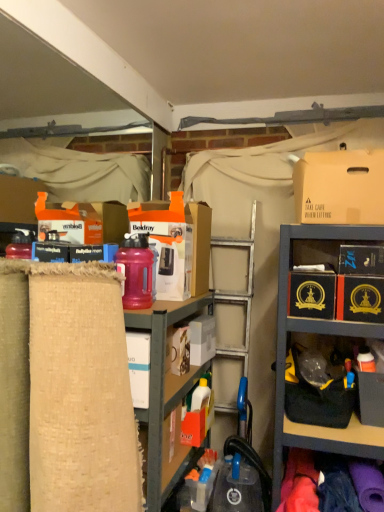
This screenshot has height=512, width=384. I want to click on brown cardboard box at upper right, so click(x=340, y=187).

This screenshot has width=384, height=512. What do you see at coordinates (360, 298) in the screenshot? I see `black cardboard box at right, the first storage box in the right-to-left sequence` at bounding box center [360, 298].

Find the location of a particular element. pink matte water bottle at center-left is located at coordinates (136, 271).

I want to click on white cardboard box at center, marked as the 1th storage box in a left-to-right arrangement, so click(x=177, y=246).

Locate an element on the screen. This screenshot has width=384, height=512. brown cardboard box at upper right is located at coordinates (340, 187).

From the image's perspective, which one is positioned higher, black cardboard box at right, acting as the fifth storage box starting from the left, or white cardboard box at center, the 2th storage box from the left?

From the image's view, black cardboard box at right, acting as the fifth storage box starting from the left, is above.

In terms of size, does black cardboard box at right, acting as the fifth storage box starting from the left, appear bigger or smaller than white cardboard box at center, marked as the 4th storage box in a right-to-left arrangement?

Clearly, black cardboard box at right, acting as the fifth storage box starting from the left, is larger in size than white cardboard box at center, marked as the 4th storage box in a right-to-left arrangement.

Is black cardboard box at right, acting as the fifth storage box starting from the left, positioned with its back to white cardboard box at center, the 2th storage box from the left?

That's not correct — black cardboard box at right, acting as the fifth storage box starting from the left, is not looking away from white cardboard box at center, the 2th storage box from the left.

Is white cardboard box at center, the 2th storage box from the left, next to black cardboard box at center-right, acting as the third storage box starting from the right, and touching it?

white cardboard box at center, the 2th storage box from the left, is not next to black cardboard box at center-right, acting as the third storage box starting from the right, and they're not touching.

From a real-world perspective, is white cardboard box at center, the 2th storage box from the left, over black cardboard box at center-right, acting as the third storage box starting from the right?

No, from a real-world perspective, white cardboard box at center, the 2th storage box from the left, is not on top of black cardboard box at center-right, acting as the third storage box starting from the right.

Looking at this image, does white cardboard box at center, the 2th storage box from the left, have a lesser width compared to black cardboard box at center-right, which is the third storage box in left-to-right order?

Correct, the width of white cardboard box at center, the 2th storage box from the left, is less than that of black cardboard box at center-right, which is the third storage box in left-to-right order.

Which of these two, white cardboard box at center, marked as the 4th storage box in a right-to-left arrangement, or black cardboard box at center-right, acting as the third storage box starting from the right, is bigger?

With larger size is black cardboard box at center-right, acting as the third storage box starting from the right.

Is burlap fabric at left beside black cardboard box at upper right, arranged as the second storage box when viewed from the right?

No, burlap fabric at left is not with black cardboard box at upper right, arranged as the second storage box when viewed from the right.

Considering the sizes of objects burlap fabric at left and black cardboard box at upper right, the fourth storage box from the left, in the image provided, who is bigger, burlap fabric at left or black cardboard box at upper right, the fourth storage box from the left,?

With larger size is burlap fabric at left.

From the image's perspective, relative to black cardboard box at upper right, the fourth storage box from the left, is burlap fabric at left above or below?

Clearly, from the image's perspective, burlap fabric at left is below black cardboard box at upper right, the fourth storage box from the left.

Based on the photo, in the image, is black cardboard box at right, acting as the fifth storage box starting from the left, on the left side or the right side of brown cardboard box at upper right?

Clearly, black cardboard box at right, acting as the fifth storage box starting from the left, is on the right of brown cardboard box at upper right in the image.

Is brown cardboard box at upper right at the back of black cardboard box at right, acting as the fifth storage box starting from the left?

No, black cardboard box at right, acting as the fifth storage box starting from the left, is not facing away from brown cardboard box at upper right.

Does black cardboard box at right, the first storage box in the right-to-left sequence, lie behind brown cardboard box at upper right?

Yes, black cardboard box at right, the first storage box in the right-to-left sequence, is behind brown cardboard box at upper right.

In order to click on cardboard box in front of the black cardboard box at right, the first storage box in the right-to-left sequence in this screenshot , I will do `click(340, 187)`.

Considering the points (192, 224) and (327, 192), which point is behind, point (192, 224) or point (327, 192)?

Positioned behind is point (192, 224).

Between white cardboard box at center, marked as the 1th storage box in a left-to-right arrangement, and brown cardboard box at upper right, which one has larger width?

brown cardboard box at upper right is wider.

Is white cardboard box at center, marked as the 1th storage box in a left-to-right arrangement, not close to brown cardboard box at upper right?

No, white cardboard box at center, marked as the 1th storage box in a left-to-right arrangement, is not far from brown cardboard box at upper right.

Is white cardboard box at center, marked as the 5th storage box in a right-to-left arrangement, completely or partially outside of brown cardboard box at upper right?

white cardboard box at center, marked as the 5th storage box in a right-to-left arrangement, is positioned outside brown cardboard box at upper right.

Is pink matte water bottle at center-left far away from black cardboard box at upper right, arranged as the second storage box when viewed from the right?

No, pink matte water bottle at center-left is not far from black cardboard box at upper right, arranged as the second storage box when viewed from the right.

Is pink matte water bottle at center-left positioned with its back to black cardboard box at upper right, arranged as the second storage box when viewed from the right?

pink matte water bottle at center-left is not turned away from black cardboard box at upper right, arranged as the second storage box when viewed from the right.

Is black cardboard box at upper right, arranged as the second storage box when viewed from the right, a part of pink matte water bottle at center-left?

Actually, black cardboard box at upper right, arranged as the second storage box when viewed from the right, is outside pink matte water bottle at center-left.

From a real-world perspective, relative to black cardboard box at upper right, the fourth storage box from the left, is pink matte water bottle at center-left vertically above or below?

Clearly, from a real-world perspective, pink matte water bottle at center-left is below black cardboard box at upper right, the fourth storage box from the left.

Which object is further away from the camera taking this photo, black cardboard box at upper right, the fourth storage box from the left, or white cardboard box at center, marked as the 5th storage box in a right-to-left arrangement?

Positioned behind is white cardboard box at center, marked as the 5th storage box in a right-to-left arrangement.

Measure the distance between black cardboard box at upper right, arranged as the second storage box when viewed from the right, and white cardboard box at center, marked as the 1th storage box in a left-to-right arrangement.

26.37 inches.

In the scene shown: Is black cardboard box at upper right, arranged as the second storage box when viewed from the right, facing towards white cardboard box at center, marked as the 5th storage box in a right-to-left arrangement?

No, black cardboard box at upper right, arranged as the second storage box when viewed from the right, does not turn towards white cardboard box at center, marked as the 5th storage box in a right-to-left arrangement.

Is black cardboard box at upper right, arranged as the second storage box when viewed from the right, shorter than white cardboard box at center, marked as the 5th storage box in a right-to-left arrangement?

Indeed, black cardboard box at upper right, arranged as the second storage box when viewed from the right, has a lesser height compared to white cardboard box at center, marked as the 5th storage box in a right-to-left arrangement.

Where is `storage box located below the black cardboard box at right, acting as the fifth storage box starting from the left (from the image's perspective)`? This screenshot has width=384, height=512. storage box located below the black cardboard box at right, acting as the fifth storage box starting from the left (from the image's perspective) is located at coordinates (202, 339).

Where is `storage box that is the 2nd one when counting upward from the white cardboard box at center, marked as the 4th storage box in a right-to-left arrangement (from the image's perspective)`? The image size is (384, 512). storage box that is the 2nd one when counting upward from the white cardboard box at center, marked as the 4th storage box in a right-to-left arrangement (from the image's perspective) is located at coordinates (312, 294).

Which object lies nearer to the anchor point burlap fabric at left, white cardboard box at center, marked as the 5th storage box in a right-to-left arrangement, or pink matte water bottle at center-left?

Among the two, pink matte water bottle at center-left is located nearer to burlap fabric at left.

Which object lies nearer to the anchor point burlap fabric at left, pink matte water bottle at center-left or black cardboard box at center-right, which is the third storage box in left-to-right order?

Among the two, pink matte water bottle at center-left is located nearer to burlap fabric at left.

When comparing their distances from brown cardboard box at upper right, does pink matte water bottle at center-left or black cardboard box at center-right, acting as the third storage box starting from the right, seem further?

pink matte water bottle at center-left is further to brown cardboard box at upper right.

Estimate the real-world distances between objects in this image. Which object is further from black cardboard box at center-right, acting as the third storage box starting from the right, black cardboard box at right, the first storage box in the right-to-left sequence, or burlap fabric at left?

burlap fabric at left is further to black cardboard box at center-right, acting as the third storage box starting from the right.

Based on their spatial positions, is black cardboard box at right, acting as the fifth storage box starting from the left, or black cardboard box at upper right, arranged as the second storage box when viewed from the right, closer to black cardboard box at center-right, which is the third storage box in left-to-right order?

black cardboard box at right, acting as the fifth storage box starting from the left, is closer to black cardboard box at center-right, which is the third storage box in left-to-right order.

Looking at the image, which one is located closer to burlap fabric at left, brown cardboard box at upper right or black cardboard box at center-right, acting as the third storage box starting from the right?

black cardboard box at center-right, acting as the third storage box starting from the right, is closer to burlap fabric at left.

Which object lies further to the anchor point black cardboard box at upper right, arranged as the second storage box when viewed from the right, black cardboard box at right, acting as the fifth storage box starting from the left, or black cardboard box at center-right, acting as the third storage box starting from the right?

black cardboard box at center-right, acting as the third storage box starting from the right, is positioned further to the anchor black cardboard box at upper right, arranged as the second storage box when viewed from the right.

When comparing their distances from white cardboard box at center, marked as the 4th storage box in a right-to-left arrangement, does pink matte water bottle at center-left or burlap fabric at left seem further?

pink matte water bottle at center-left lies further to white cardboard box at center, marked as the 4th storage box in a right-to-left arrangement, than the other object.

In order to click on shelf situated between pink matte water bottle at center-left and black cardboard box at center-right, which is the third storage box in left-to-right order, from left to right in this screenshot , I will do `click(164, 386)`.

Find the location of a particular element. cardboard box located between pink matte water bottle at center-left and black cardboard box at upper right, arranged as the second storage box when viewed from the right, in the left-right direction is located at coordinates (340, 187).

Find the location of a particular element. The image size is (384, 512). storage box between white cardboard box at center, marked as the 5th storage box in a right-to-left arrangement, and black cardboard box at center-right, which is the third storage box in left-to-right order, in the horizontal direction is located at coordinates (202, 339).

The width and height of the screenshot is (384, 512). In order to click on shelf located between pink matte water bottle at center-left and black cardboard box at right, the first storage box in the right-to-left sequence, in the left-right direction in this screenshot , I will do click(164, 386).